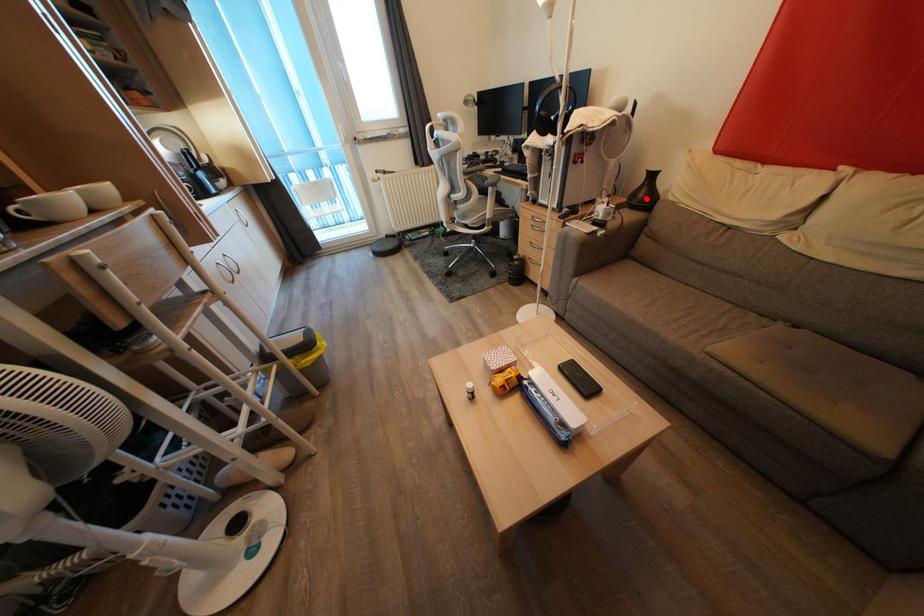
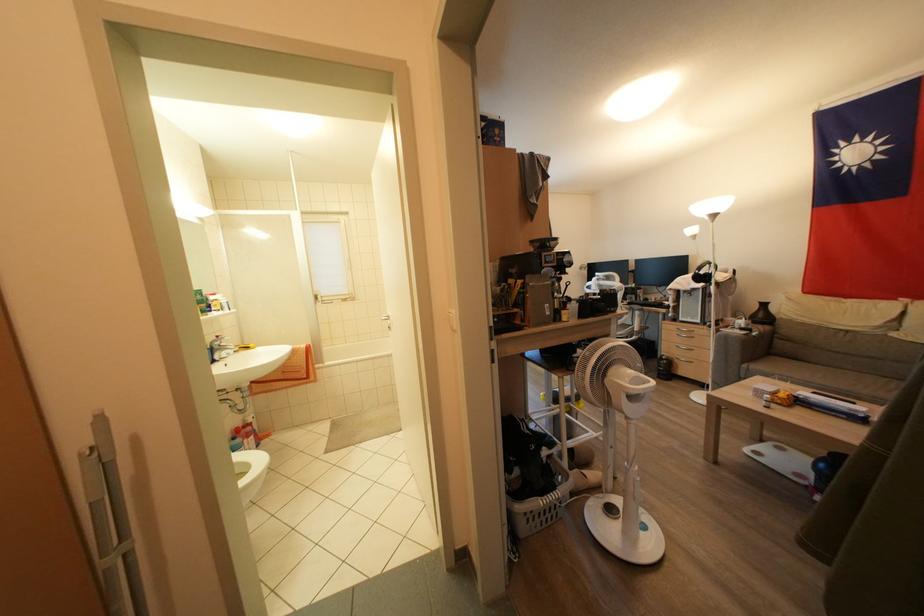
The point at the highlighted location is marked in the first image. Where is the corresponding point in the second image?

(766, 320)